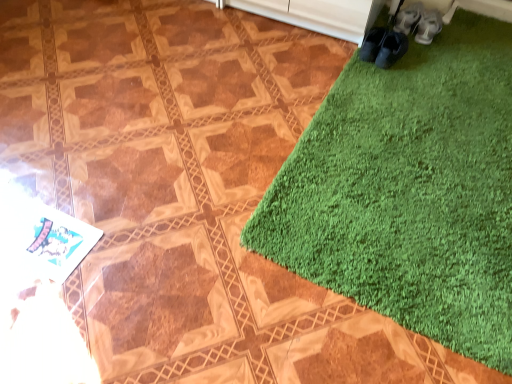
What do you see at coordinates (408, 18) in the screenshot? Image resolution: width=512 pixels, height=384 pixels. I see `white fabric shoe at upper right` at bounding box center [408, 18].

The width and height of the screenshot is (512, 384). In order to click on white fabric shoe at upper right in this screenshot , I will do `click(408, 18)`.

You are a GUI agent. You are given a task and a screenshot of the screen. Output one action in this format:
    pyautogui.click(x=<x>, y=<y>)
    Task: Click on the white fabric shoe at upper right
    
    Given the screenshot: What is the action you would take?
    point(408,18)